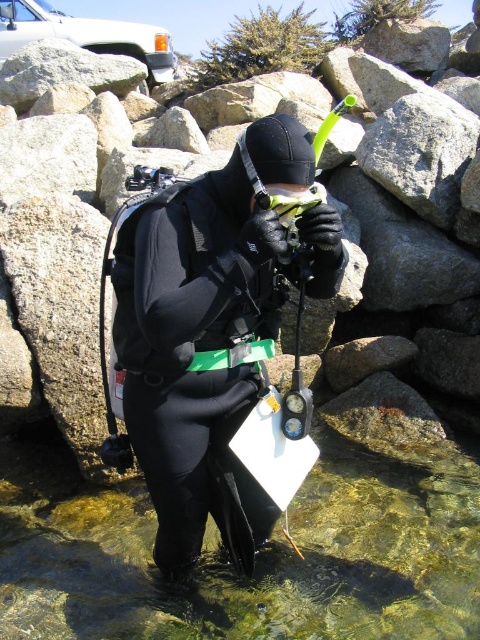
Looking at this image, you are a scuba diver preparing to enter the water. You notice the black matte scuba tank at center and the matte black goggles at center. Which object is positioned to the right side of the other?

The matte black goggles at center are positioned to the right of the black matte scuba tank at center.

You are a safety inspector reviewing the scuba diving equipment setup. You notice the black matte wetsuit at center and the matte black goggles at center. Which item is more likely to be the correct size for the diver based on their visibility and positioning?

The black matte wetsuit at center is larger in size than the matte black goggles at center, so it is more likely to be the correct size for the diver since the wetsuit needs to cover the body appropriately while the goggles are smaller and fit around the eyes.

You are a marine biologist planning to collect water samples from the clear water at lower center. The coordinates of the clear water are given as point (x=229, y=566). Based on the scene, can you determine if the diver is positioned closer to the clear water at lower center than the rocky shoreline?

The clear water at lower center is represented by point (x=229, y=566). Since the diver is standing in shallow water near a rocky shoreline, they are closer to the rocky shoreline than the clear water at lower center.